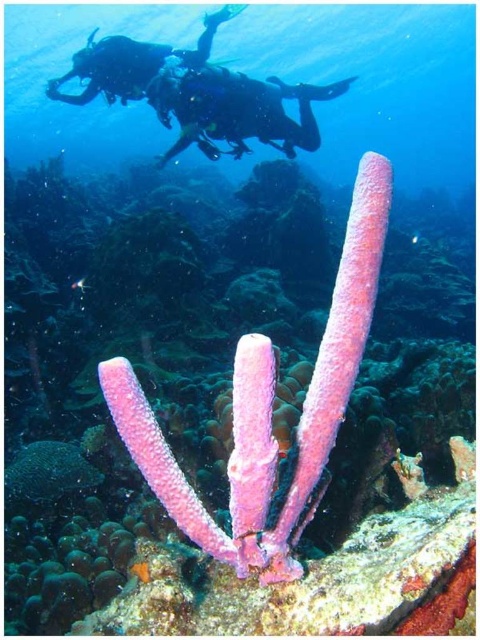
Can you confirm if pink sponge at center is taller than matte black scuba diver at upper left?

Correct, pink sponge at center is much taller as matte black scuba diver at upper left.

Who is more distant from viewer, (416, 632) or (162, 64)?

The point (162, 64) is more distant.

Which is behind, point (190, 634) or point (104, 64)?

The point (104, 64) is more distant.

Locate an element on the screen. pink sponge at center is located at coordinates (248, 522).

Is point (252, 106) positioned before point (94, 77)?

Yes.

Which of these two, matte black scuba diver at upper center or matte black scuba diver at upper left, stands shorter?

With less height is matte black scuba diver at upper left.

Between point (170, 81) and point (103, 67), which one is positioned in front?

Point (170, 81) is in front.

This screenshot has height=640, width=480. I want to click on matte black scuba diver at upper center, so click(x=236, y=109).

Can you confirm if pink sponge at center is positioned to the right of matte black scuba diver at upper center?

Incorrect, pink sponge at center is not on the right side of matte black scuba diver at upper center.

Between point (46, 595) and point (168, 96), which one is positioned in front?

Positioned in front is point (46, 595).

You are a GUI agent. You are given a task and a screenshot of the screen. Output one action in this format:
    pyautogui.click(x=<x>, y=<y>)
    Task: Click on the pink sponge at center
    This screenshot has width=480, height=640.
    Given the screenshot: What is the action you would take?
    pyautogui.click(x=248, y=522)